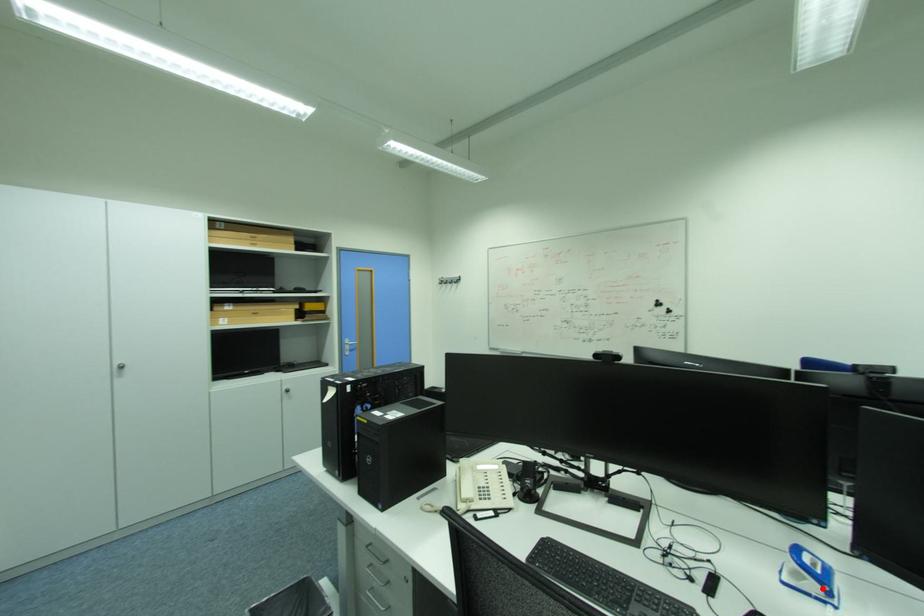
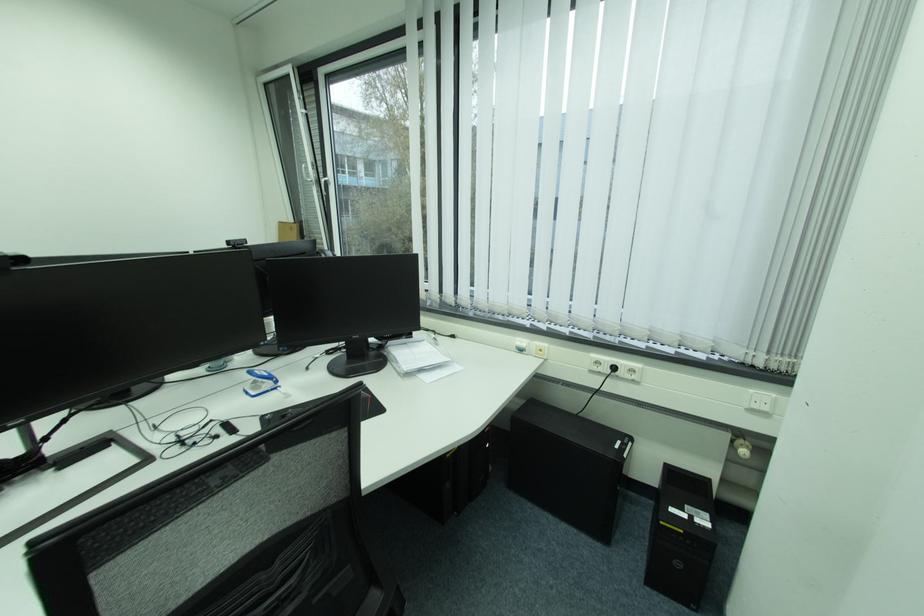
In the second image, find the point that corresponds to the highlighted location in the first image.

(275, 386)